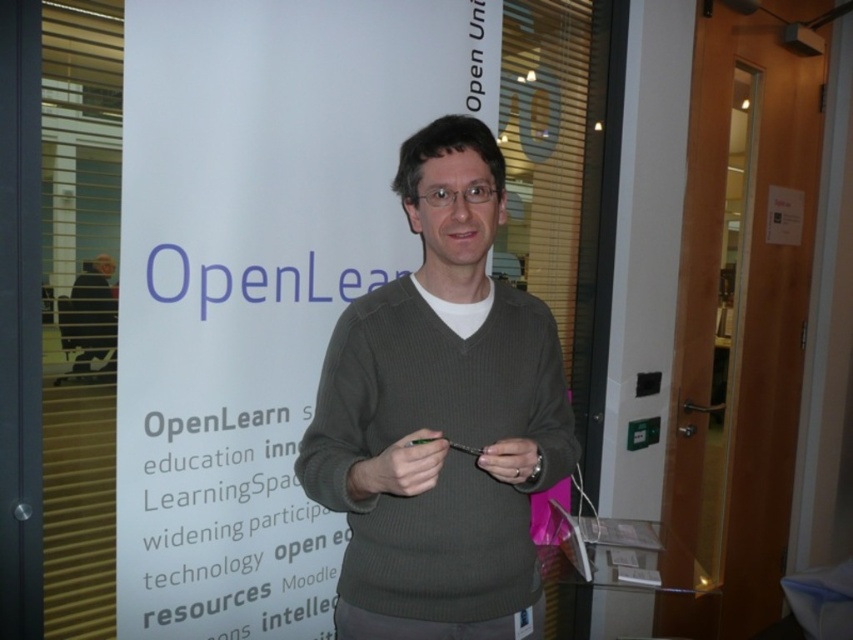
Consider the image. Between matte green pen at center and matte gray hand at center, which one appears on the right side from the viewer's perspective?

Positioned to the right is matte gray hand at center.

Which is in front, point (387, 452) or point (509, 465)?

Positioned in front is point (387, 452).

Is point (381, 456) positioned in front of point (480, 461)?

That is True.

Locate an element on the screen. matte green pen at center is located at coordinates (399, 467).

Who is positioned more to the left, knitted sweater at center or matte gray hand at center?

From the viewer's perspective, knitted sweater at center appears more on the left side.

What do you see at coordinates (440, 413) in the screenshot? I see `knitted sweater at center` at bounding box center [440, 413].

Is point (477, 634) closer to camera compared to point (489, 472)?

No, it is behind (489, 472).

Where is `knitted sweater at center`? The height and width of the screenshot is (640, 853). knitted sweater at center is located at coordinates (440, 413).

Can you confirm if knitted sweater at center is taller than matte green pen at center?

Indeed, knitted sweater at center has a greater height compared to matte green pen at center.

Between knitted sweater at center and matte green pen at center, which one has less height?

matte green pen at center

Locate an element on the screen. knitted sweater at center is located at coordinates (440, 413).

You are a GUI agent. You are given a task and a screenshot of the screen. Output one action in this format:
    pyautogui.click(x=<x>, y=<y>)
    Task: Click on the knitted sweater at center
    The image size is (853, 640).
    Given the screenshot: What is the action you would take?
    pyautogui.click(x=440, y=413)